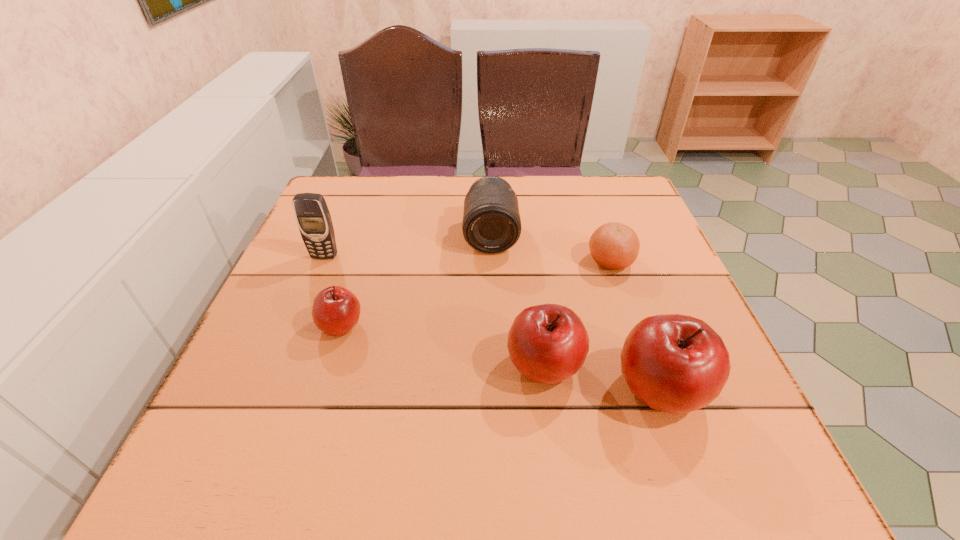
Find the location of `vacant space that satisfies the following two spatial constraints: 1. on the front face of the cellular telephone; 2. on the right side of the second apple from right to left`. vacant space that satisfies the following two spatial constraints: 1. on the front face of the cellular telephone; 2. on the right side of the second apple from right to left is located at coordinates (279, 367).

You are a GUI agent. You are given a task and a screenshot of the screen. Output one action in this format:
    pyautogui.click(x=<x>, y=<y>)
    Task: Click on the vacant space that satisfies the following two spatial constraints: 1. on the back side of the clementine; 2. on the right side of the shortest apple
    The image size is (960, 540).
    Given the screenshot: What is the action you would take?
    pyautogui.click(x=361, y=261)

Where is `free space that satisfies the following two spatial constraints: 1. on the surface of the telephoto lens; 2. on the right side of the clementine`? This screenshot has width=960, height=540. free space that satisfies the following two spatial constraints: 1. on the surface of the telephoto lens; 2. on the right side of the clementine is located at coordinates (492, 261).

You are a GUI agent. You are given a task and a screenshot of the screen. Output one action in this format:
    pyautogui.click(x=<x>, y=<y>)
    Task: Click on the vacant point that satisfies the following two spatial constraints: 1. on the surface of the telephoto lens; 2. on the right side of the second shortest apple
    The height and width of the screenshot is (540, 960).
    Given the screenshot: What is the action you would take?
    pyautogui.click(x=494, y=367)